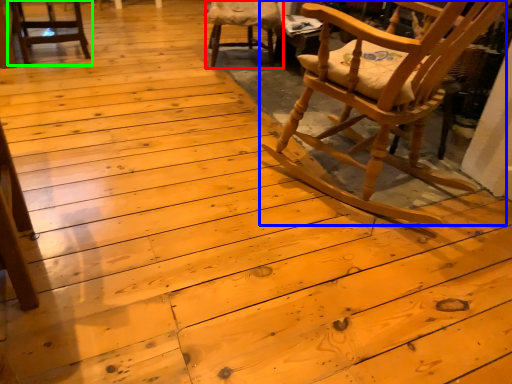
Question: Estimate the real-world distances between objects in this image. Which object is farther from chair (highlighted by a red box), chair (highlighted by a blue box) or chair (highlighted by a green box)?

Choices:
 (A) chair
 (B) chair

Answer: (A)